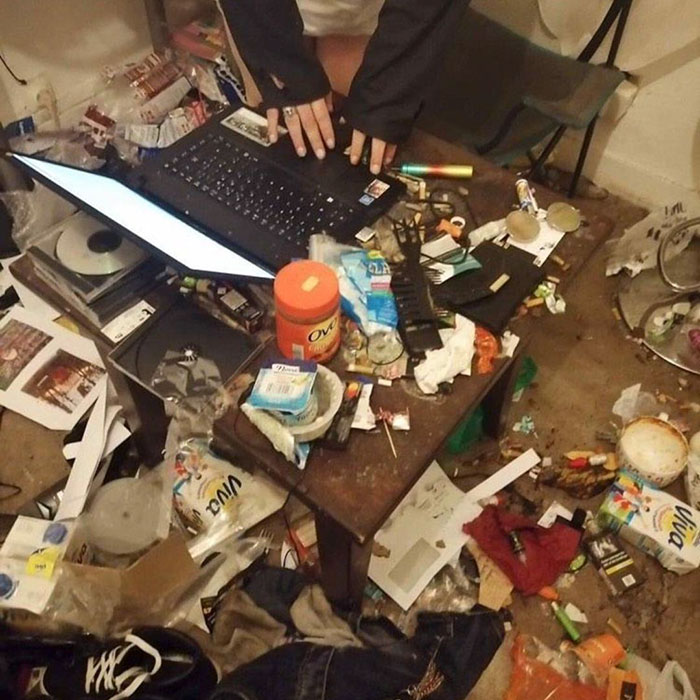
This screenshot has width=700, height=700. I want to click on keyboard, so click(292, 216).